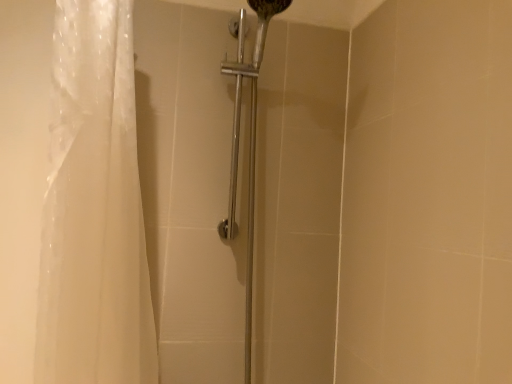
In order to face transparent plastic shower curtain at left, should I rotate leftwards or rightwards?

Turn left approximately 15.836 degrees to face it.

At what (x,y) coordinates should I click in order to perform the action: click on transparent plastic shower curtain at left. Please return your answer as a coordinate pair (x, y). The height and width of the screenshot is (384, 512). Looking at the image, I should click on (94, 209).

The image size is (512, 384). What do you see at coordinates (94, 209) in the screenshot?
I see `transparent plastic shower curtain at left` at bounding box center [94, 209].

Find the location of a particular element. transparent plastic shower curtain at left is located at coordinates (94, 209).